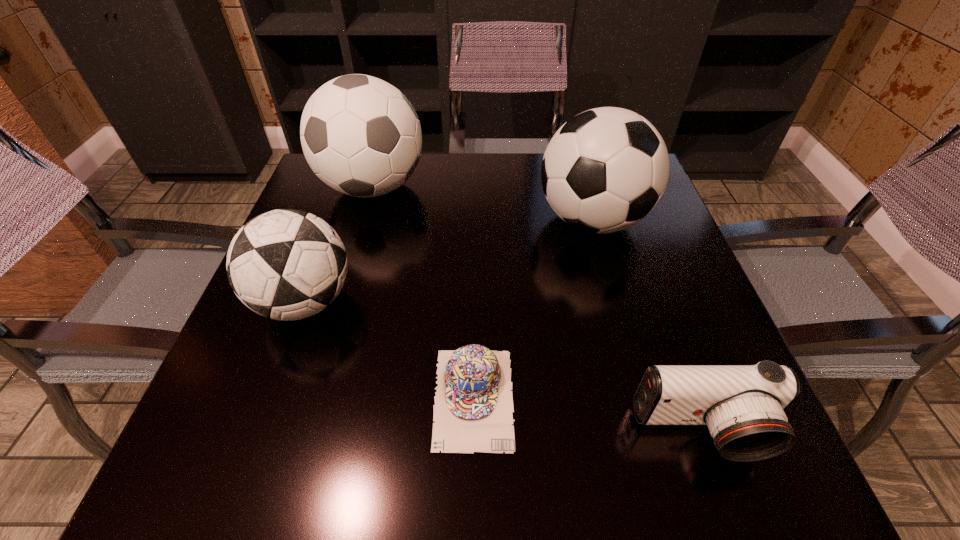
The height and width of the screenshot is (540, 960). I want to click on vacant space at the near left corner, so click(x=181, y=468).

I want to click on unoccupied position between the camcorder and the cap, so click(588, 415).

You are a GUI agent. You are given a task and a screenshot of the screen. Output one action in this format:
    pyautogui.click(x=<x>, y=<y>)
    Task: Click on the vacant point located between the shortest object and the rightmost soccer ball
    This screenshot has width=960, height=540.
    Given the screenshot: What is the action you would take?
    pyautogui.click(x=533, y=309)

This screenshot has height=540, width=960. Find the location of `free area in between the rightmost soccer ball and the third object from right to left`. free area in between the rightmost soccer ball and the third object from right to left is located at coordinates (533, 309).

This screenshot has height=540, width=960. Identify the location of free spot between the shortest soccer ball and the rightmost soccer ball. (448, 261).

Identify which object is the second nearest to the camcorder. Please provide its 2D coordinates. Your answer should be formatted as a tuple, i.e. [(x, y)], where the tuple contains the x and y coordinates of a point satisfying the conditions above.

[(604, 170)]

At what (x,y) coordinates should I click in order to perform the action: click on object that is the fourth closest to the rightmost soccer ball. Please return your answer as a coordinate pair (x, y). The width and height of the screenshot is (960, 540). Looking at the image, I should click on (286, 264).

Locate which soccer ball is the second closest to the shortest object. Please provide its 2D coordinates. Your answer should be formatted as a tuple, i.e. [(x, y)], where the tuple contains the x and y coordinates of a point satisfying the conditions above.

[(604, 170)]

This screenshot has height=540, width=960. I want to click on soccer ball that stands as the closest to the camcorder, so click(604, 170).

At what (x,y) coordinates should I click in order to perform the action: click on vacant point that satisfies the following two spatial constraints: 1. on the front side of the rightmost soccer ball; 2. on the surface of the third nearest object where the brand logo is visible. Please return your answer as a coordinate pair (x, y). This screenshot has width=960, height=540. Looking at the image, I should click on click(615, 301).